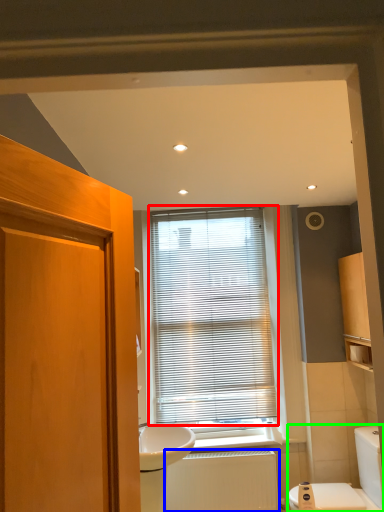
Question: Which object is positioned farthest from window blind (highlighted by a red box)? Select from radiator (highlighted by a blue box) and toilet (highlighted by a green box).

Choices:
 (A) radiator
 (B) toilet

Answer: (B)